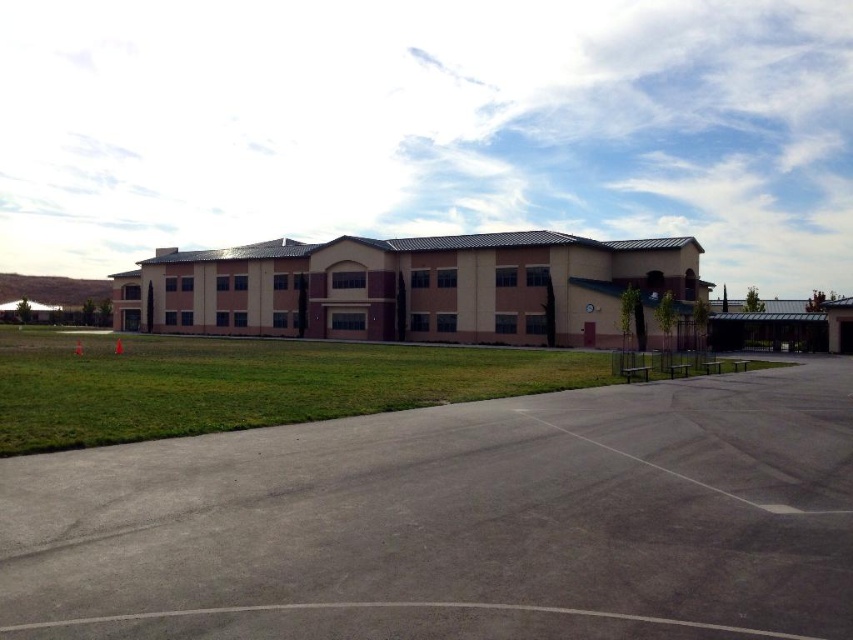
You are standing at the origin point of the coordinate system. You want to walk to the beige stucco building at center. Which direction should you go?

The beige stucco building at center is located at coordinate point (410, 288), so you should move towards the northeast direction from your current position at the origin.

You are standing at point (410, 288). What is the nearest object to you?

The beige stucco building at center is located at point (410, 288), so you are standing right at the building itself.

You are standing in front of the beige stucco building at center and looking towards the green grass at center. Which object is closer to you?

The beige stucco building at center is closer to you than the green grass at center because it is positioned further to the viewer, making it appear nearer in your line of sight.